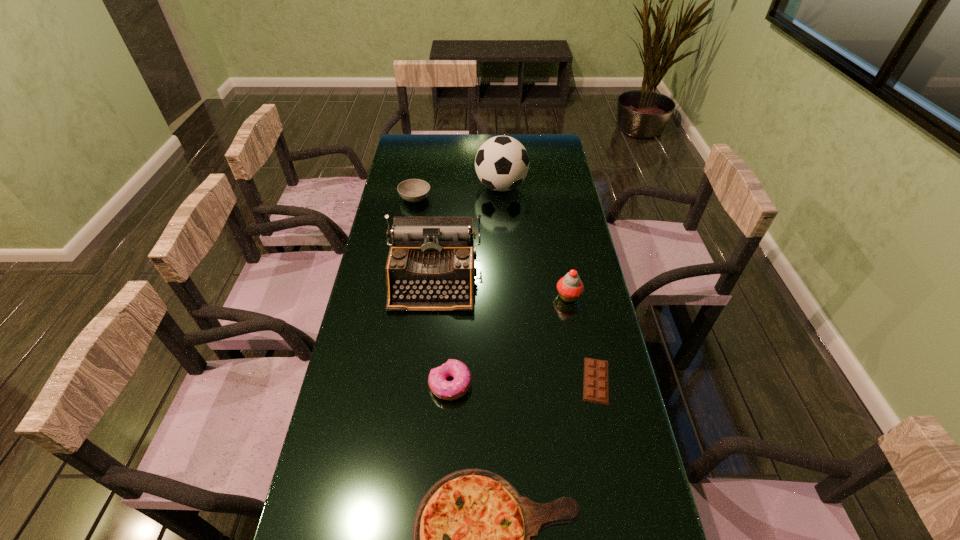
Locate an element on the screen. soccer ball is located at coordinates (502, 162).

Locate an element on the screen. The height and width of the screenshot is (540, 960). typewriter is located at coordinates (431, 264).

This screenshot has width=960, height=540. I want to click on cupcake, so click(570, 287).

Find the location of `bowl`. bowl is located at coordinates (413, 190).

This screenshot has width=960, height=540. What are the coordinates of `doughnut` in the screenshot? It's located at (447, 390).

Where is `the shortest object`? the shortest object is located at coordinates (596, 372).

Identify the location of free location located 0.200m on the back of the soccer ball. (499, 148).

This screenshot has height=540, width=960. I want to click on free region located on the keyboard of the sixth shortest object, so click(426, 350).

The image size is (960, 540). I want to click on vacant space situated 0.170m on the left of the third tallest object, so click(502, 296).

Identify the location of free region located 0.180m on the front of the bowl. This screenshot has width=960, height=540. (408, 238).